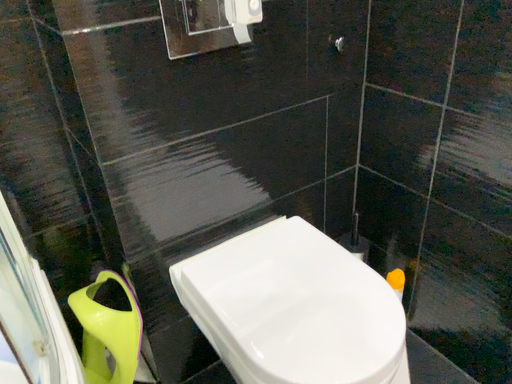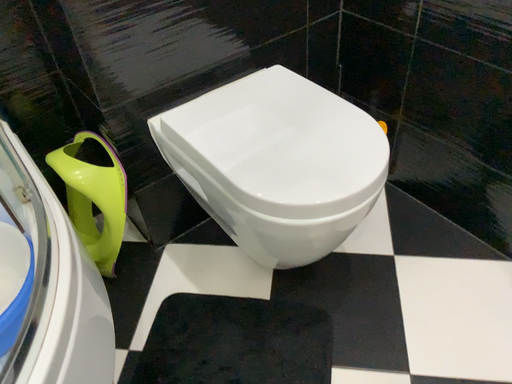
Question: How did the camera likely rotate when shooting the video?

Choices:
 (A) rotated upward
 (B) rotated downward

Answer: (B)